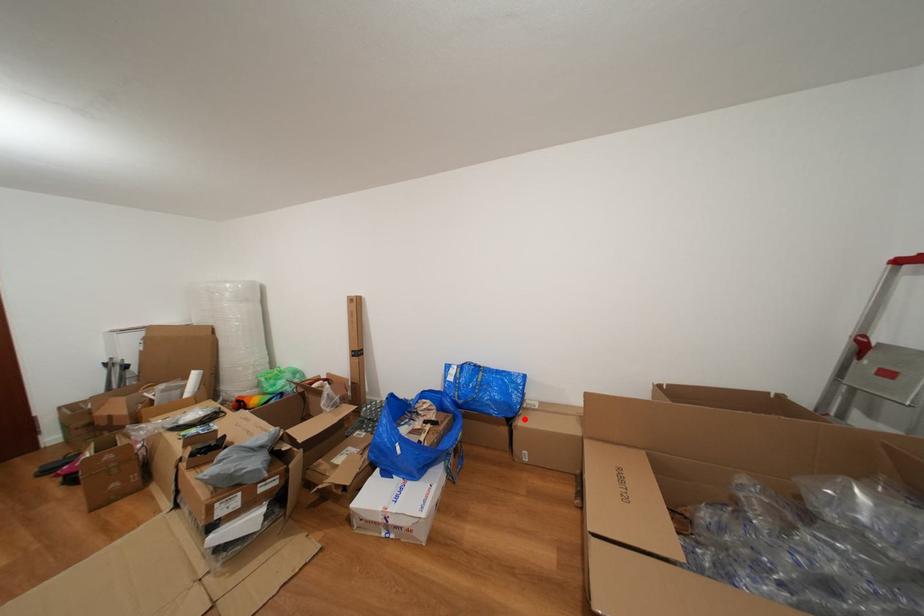
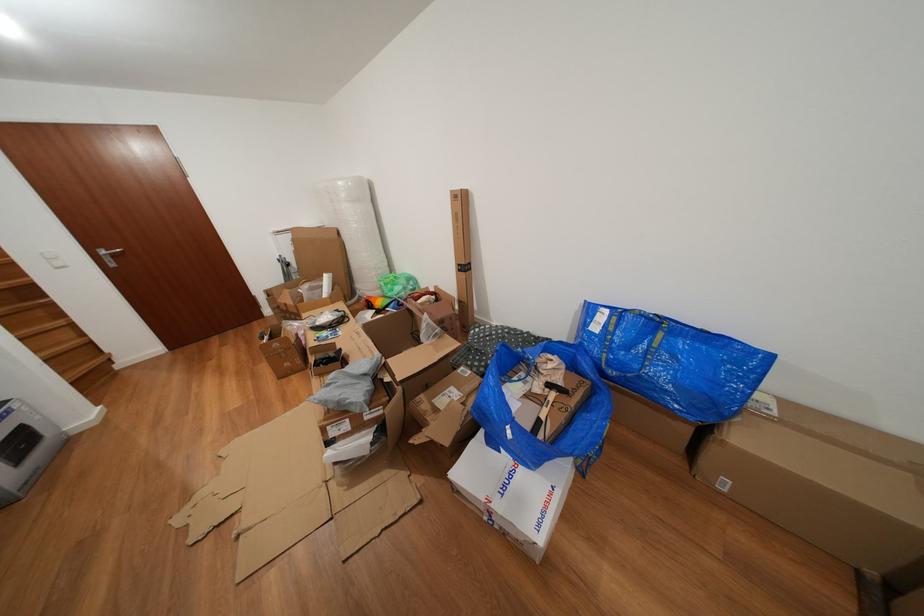
Where in the second image is the point corresponding to the highlighted location from the first image?

(734, 424)